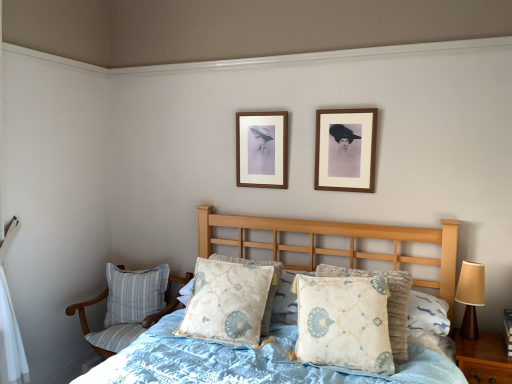
Question: In terms of width, does wooden picture frame at upper center, placed as the first picture frame when sorted from back to front, look wider or thinner when compared to floral-patterned fabric pillow at center, which appears as the 1th pillow when viewed from the right?

Choices:
 (A) thin
 (B) wide

Answer: (A)

Question: Looking at the image, does wooden picture frame at upper center, the 2th picture frame in the right-to-left sequence, seem bigger or smaller compared to floral-patterned fabric pillow at center, which appears as the 1th pillow when viewed from the right?

Choices:
 (A) big
 (B) small

Answer: (B)

Question: Considering the real-world distances, which object is farthest from the wooden picture frame at upper center, the 1th picture frame from the right?

Choices:
 (A) blue striped fabric pillow at lower left, marked as the 3th pillow in a right-to-left arrangement
 (B) light blue quilted bed at center
 (C) floral-patterned fabric pillow at center, the 1th pillow from the front
 (D) floral-patterned fabric pillow at center, the 2th pillow positioned from the left
 (E) brown matte table lamp at right

Answer: (A)

Question: Which object is the farthest from the floral-patterned fabric pillow at center, the second pillow from the right?

Choices:
 (A) wooden picture frame at upper center, which ranks as the second picture frame in back-to-front order
 (B) floral-patterned fabric pillow at center, the 1th pillow from the front
 (C) wooden picture frame at upper center, the 1th picture frame viewed from the left
 (D) brown matte table lamp at right
 (E) striped fabric chair at lower left

Answer: (D)